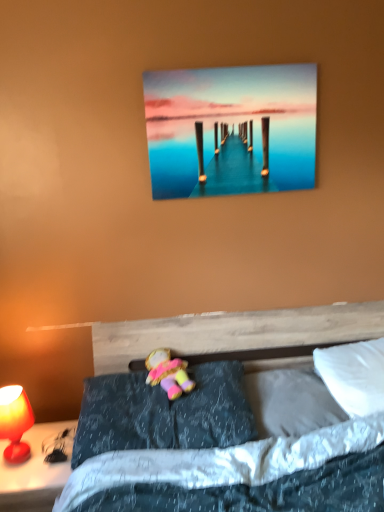
This screenshot has height=512, width=384. I want to click on soft plush doll at center, so click(x=168, y=373).

This screenshot has height=512, width=384. Describe the element at coordinates (163, 413) in the screenshot. I see `dark gray fabric pillow at center, placed as the 3th pillow when sorted from right to left` at that location.

In order to face matte red lamp at left, should I rotate leftwards or rightwards?

Rotate your view left by about 22.876°.

Locate an element on the screen. The width and height of the screenshot is (384, 512). white soft pillow at lower right, which appears as the 2th pillow when viewed from the left is located at coordinates (290, 402).

Is matte red lamp at left inside the boundaries of matte red lamp at lower left, or outside?

matte red lamp at left is located beyond the bounds of matte red lamp at lower left.

Considering the relative positions of matte red lamp at left and matte red lamp at lower left in the image provided, is matte red lamp at left to the left of matte red lamp at lower left from the viewer's perspective?

Yes.

From the image's perspective, does matte red lamp at left appear higher than matte red lamp at lower left?

Yes, from the image's perspective, matte red lamp at left is on top of matte red lamp at lower left.

Could you tell me if white soft pillow at lower right, which is the second pillow from right to left, is facing matte red lamp at lower left?

No.

In the scene shown: Choose the correct answer: Is white soft pillow at lower right, which is the second pillow from right to left, inside matte red lamp at lower left or outside it?

white soft pillow at lower right, which is the second pillow from right to left, lies outside matte red lamp at lower left.

Is white soft pillow at lower right, which appears as the 2th pillow when viewed from the left, positioned far away from matte red lamp at lower left?

No, white soft pillow at lower right, which appears as the 2th pillow when viewed from the left, is not far from matte red lamp at lower left.

Considering the sizes of objects white soft pillow at lower right, which is the second pillow from right to left, and matte red lamp at lower left in the image provided, who is taller, white soft pillow at lower right, which is the second pillow from right to left, or matte red lamp at lower left?

Standing taller between the two is matte red lamp at lower left.

Between metallic glossy pier at upper center and soft plush doll at center, which one has more height?

With more height is metallic glossy pier at upper center.

Are metallic glossy pier at upper center and soft plush doll at center making contact?

No, metallic glossy pier at upper center is not next to soft plush doll at center.

Between metallic glossy pier at upper center and soft plush doll at center, which one has larger width?

soft plush doll at center.

Is point (311, 131) behind point (178, 394)?

Yes, it is behind point (178, 394).

Can you confirm if matte red lamp at left is thinner than white soft pillow at upper right, the third pillow from the left?

Correct, the width of matte red lamp at left is less than that of white soft pillow at upper right, the third pillow from the left.

Could you tell me if matte red lamp at left is turned towards white soft pillow at upper right, which appears as the 1th pillow when viewed from the right?

No.

Where is `table lamp in front of the white soft pillow at lower right, which is the second pillow from right to left`? The width and height of the screenshot is (384, 512). table lamp in front of the white soft pillow at lower right, which is the second pillow from right to left is located at coordinates (15, 422).

Which object is further away from the camera taking this photo, white soft pillow at lower right, which appears as the 2th pillow when viewed from the left, or matte red lamp at left?

white soft pillow at lower right, which appears as the 2th pillow when viewed from the left, is more distant.

From a real-world perspective, is white soft pillow at lower right, which appears as the 2th pillow when viewed from the left, positioned above or below matte red lamp at left?

white soft pillow at lower right, which appears as the 2th pillow when viewed from the left, is situated higher than matte red lamp at left in the real world.

Does white soft pillow at lower right, which appears as the 2th pillow when viewed from the left, have a greater height compared to matte red lamp at left?

Incorrect, the height of white soft pillow at lower right, which appears as the 2th pillow when viewed from the left, is not larger of that of matte red lamp at left.

Could you tell me if matte red lamp at lower left is facing matte red lamp at left?

No.

Between matte red lamp at lower left and matte red lamp at left, which one is positioned in front?

matte red lamp at lower left is more forward.

Is matte red lamp at lower left beside matte red lamp at left?

They are not placed beside each other.

Which of these two, matte red lamp at lower left or matte red lamp at left, is wider?

Wider between the two is matte red lamp at lower left.

Could you tell me if matte red lamp at left is turned towards metallic glossy pier at upper center?

No, matte red lamp at left is not aimed at metallic glossy pier at upper center.

From the image's perspective, which is below, matte red lamp at left or metallic glossy pier at upper center?

matte red lamp at left.

Based on their sizes in the image, would you say matte red lamp at left is bigger or smaller than metallic glossy pier at upper center?

In the image, matte red lamp at left appears to be smaller than metallic glossy pier at upper center.

Would you say matte red lamp at left is outside metallic glossy pier at upper center?

Yes, matte red lamp at left is not within metallic glossy pier at upper center.

The height and width of the screenshot is (512, 384). In order to click on nightstand on the right of matte red lamp at left in this screenshot , I will do `click(33, 473)`.

Locate an element on the screen. pillow that is the 1st object above the matte red lamp at lower left (from a real-world perspective) is located at coordinates tap(290, 402).

From the image, which object appears to be farther from matte red lamp at left, soft plush doll at center or white soft pillow at lower right, which is the second pillow from right to left?

white soft pillow at lower right, which is the second pillow from right to left, is further to matte red lamp at left.

Considering their positions, is matte red lamp at lower left positioned closer to soft plush doll at center than white soft pillow at lower right, which is the second pillow from right to left?

white soft pillow at lower right, which is the second pillow from right to left.

Estimate the real-world distances between objects in this image. Which object is further from white soft pillow at upper right, the third pillow from the left, metallic glossy pier at upper center or matte red lamp at lower left?

matte red lamp at lower left is further to white soft pillow at upper right, the third pillow from the left.

Which object lies further to the anchor point soft plush doll at center, white soft pillow at lower right, which is the second pillow from right to left, or matte red lamp at left?

matte red lamp at left is further to soft plush doll at center.

From the image, which object appears to be nearer to white soft pillow at upper right, which appears as the 1th pillow when viewed from the right, matte red lamp at left or matte red lamp at lower left?

Based on the image, matte red lamp at lower left appears to be nearer to white soft pillow at upper right, which appears as the 1th pillow when viewed from the right.

From the image, which object appears to be farther from soft plush doll at center, white soft pillow at upper right, the third pillow from the left, or dark gray fabric pillow at center, placed as the 3th pillow when sorted from right to left?

white soft pillow at upper right, the third pillow from the left.

Considering their positions, is white soft pillow at upper right, the third pillow from the left, positioned closer to matte red lamp at left than soft plush doll at center?

The object closer to matte red lamp at left is soft plush doll at center.

When comparing their distances from metallic glossy pier at upper center, does matte red lamp at lower left or matte red lamp at left seem further?

matte red lamp at lower left lies further to metallic glossy pier at upper center than the other object.

This screenshot has width=384, height=512. Find the location of `doll that lies between metallic glossy pier at upper center and dark gray fabric pillow at center, placed as the 3th pillow when sorted from right to left, from top to bottom`. doll that lies between metallic glossy pier at upper center and dark gray fabric pillow at center, placed as the 3th pillow when sorted from right to left, from top to bottom is located at coordinates (168, 373).

Where is `pillow between matte red lamp at left and white soft pillow at lower right, which appears as the 2th pillow when viewed from the left`? pillow between matte red lamp at left and white soft pillow at lower right, which appears as the 2th pillow when viewed from the left is located at coordinates (163, 413).

This screenshot has height=512, width=384. In order to click on pillow between dark gray fabric pillow at center, which appears as the 1th pillow when viewed from the left, and white soft pillow at upper right, which appears as the 1th pillow when viewed from the right, in the horizontal direction in this screenshot , I will do `click(290, 402)`.

In order to click on nightstand situated between matte red lamp at left and dark gray fabric pillow at center, which appears as the 1th pillow when viewed from the left, from left to right in this screenshot , I will do `click(33, 473)`.